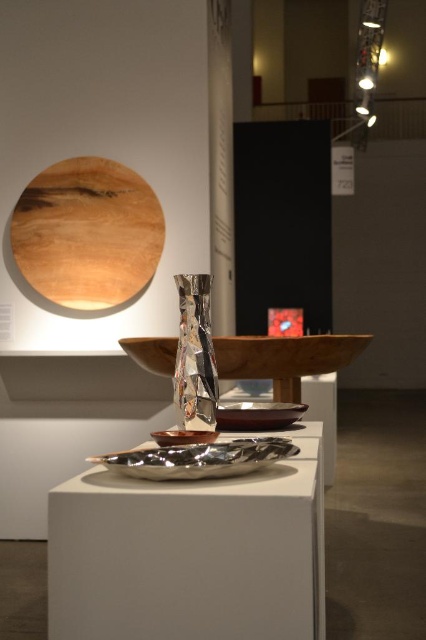
Looking at this image, you are an art curator arranging items on a table. You have a wooden platter at center and a shiny metallic bowl at center. Which object should you move to the left side of the table to align with the exhibition layout?

You should move the shiny metallic bowl at center to the left side of the table because the wooden platter at center is currently to its right, so moving the bowl left would place the platter to its right as required.

You are a visitor standing in front of the silver metallic tray at center in the art exhibition. If you want to touch it, will you be able to reach it without moving your body?

The silver metallic tray at center is 23.44 inches away from the viewer, so yes, you can reach it without moving your body since it is within arm length.